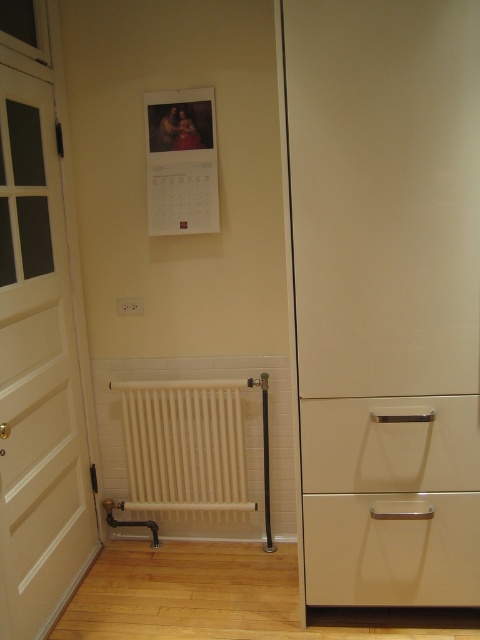
Question: Is white matte door at left positioned before white matte radiator at lower center?

Choices:
 (A) yes
 (B) no

Answer: (A)

Question: Which point is farther to the camera?

Choices:
 (A) (343, 532)
 (B) (333, 458)
 (C) (208, 492)

Answer: (C)

Question: Which object appears closest to the camera in this image?

Choices:
 (A) white matte door at left
 (B) white matte radiator at lower center

Answer: (A)

Question: In this image, where is white matte drawer at center right located relative to white matte radiator at lower center?

Choices:
 (A) above
 (B) below

Answer: (A)

Question: Can you confirm if white matte door at left is positioned above white matte drawer at center right?

Choices:
 (A) yes
 (B) no

Answer: (A)

Question: Which point is farther to the camera?

Choices:
 (A) (348, 566)
 (B) (12, 406)
 (C) (316, 481)

Answer: (A)